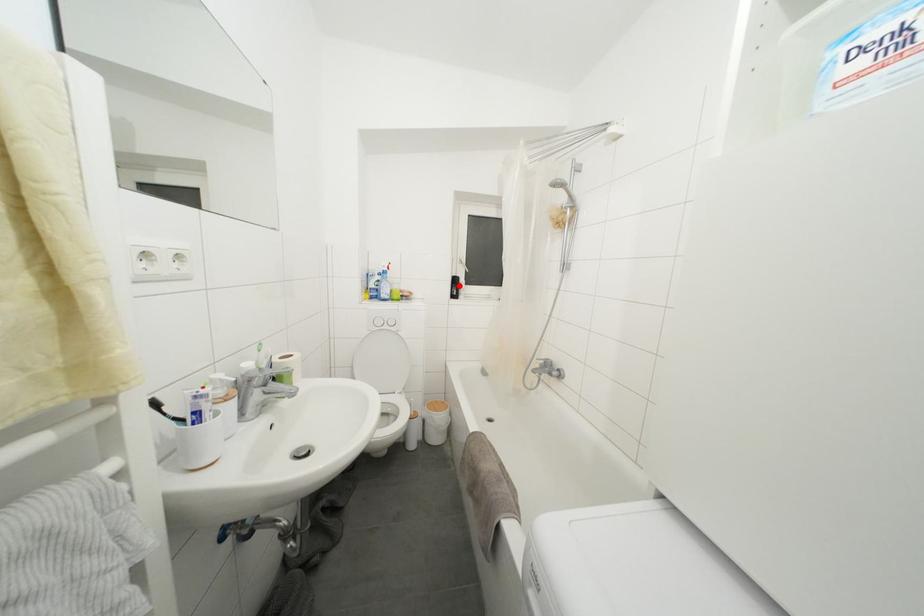
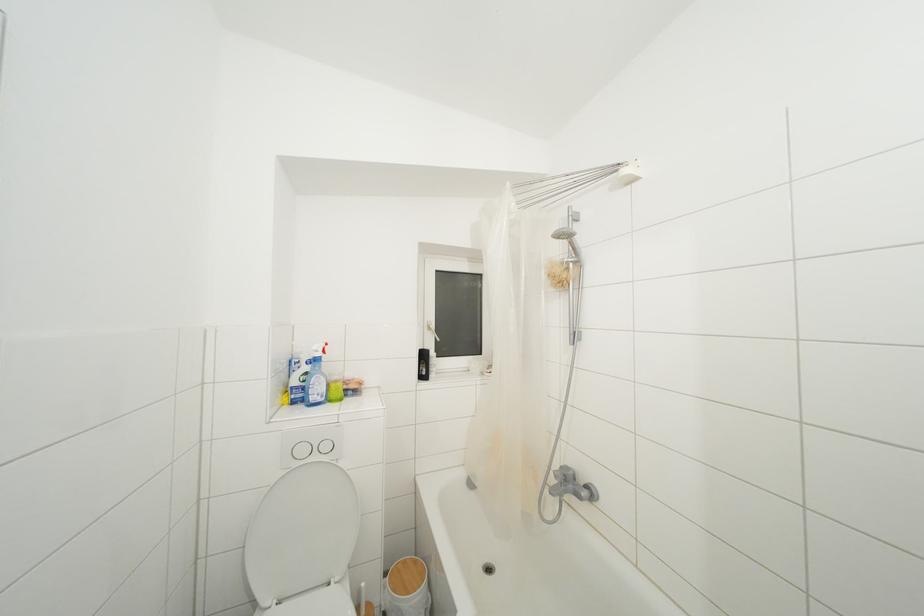
Question: I am providing you with two images of the same scene from different viewpoints. Given a red point in image1, look at the same physical point in image2. Is it:

Choices:
 (A) Closer to the viewpoint
 (B) Farther from the viewpoint

Answer: (B)